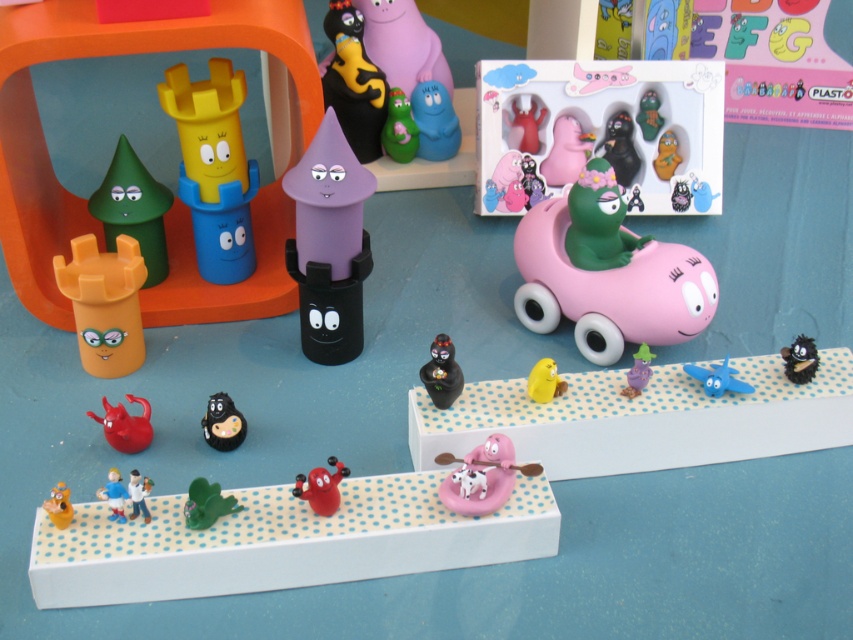
How much distance is there between green matte frog at lower center and matte yellow toy at lower left?

5.59 inches

Is point (222, 506) positioned before point (67, 492)?

No.

Where is `green matte frog at lower center`? The image size is (853, 640). green matte frog at lower center is located at coordinates (206, 502).

Identify the location of green matte frog at lower center. (206, 502).

Can you confirm if rubber duck at center is smaller than matte purple cone at center?

Actually, rubber duck at center might be larger than matte purple cone at center.

Image resolution: width=853 pixels, height=640 pixels. Describe the element at coordinates (524, 124) in the screenshot. I see `rubber duck at center` at that location.

This screenshot has width=853, height=640. Describe the element at coordinates (524, 124) in the screenshot. I see `rubber duck at center` at that location.

Where is `rubber duck at center`? This screenshot has height=640, width=853. rubber duck at center is located at coordinates (524, 124).

What do you see at coordinates (329, 243) in the screenshot? I see `purple matte toy at center` at bounding box center [329, 243].

Is purple matte toy at center further to camera compared to black matte plush toy at lower right?

No, it is not.

Find the location of `purple matte toy at center`. purple matte toy at center is located at coordinates (329, 243).